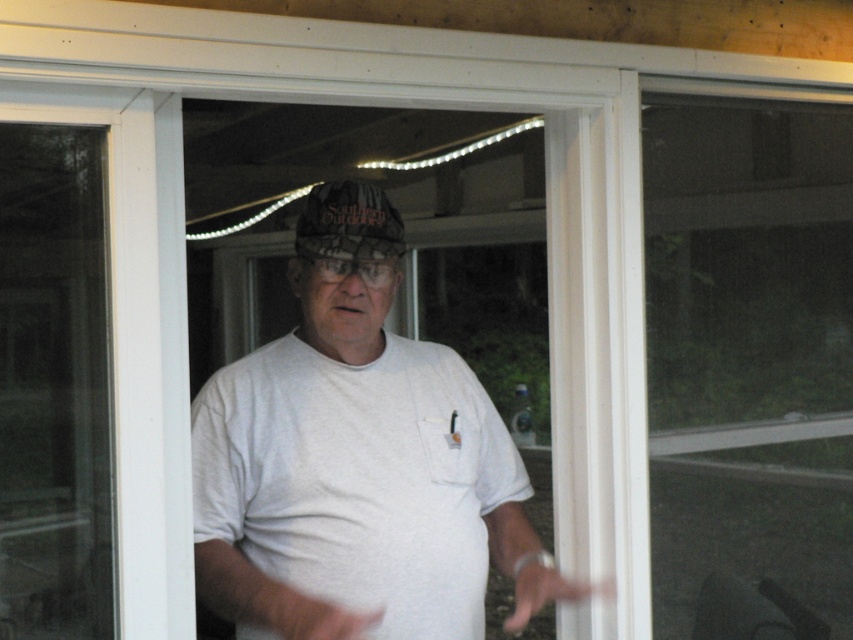
Is point (747, 211) farther from camera compared to point (326, 560)?

Yes, point (747, 211) is behind point (326, 560).

Can you confirm if transparent plastic screen door at right is thinner than white cotton t-shirt at center?

Correct, transparent plastic screen door at right's width is less than white cotton t-shirt at center's.

Is point (721, 212) in front of point (428, 408)?

No, it is not.

At what (x,y) coordinates should I click in order to perform the action: click on transparent plastic screen door at right. Please return your answer as a coordinate pair (x, y). The height and width of the screenshot is (640, 853). Looking at the image, I should click on (747, 365).

Is transparent plastic screen door at left smaller than camouflage fabric hat at center?

Actually, transparent plastic screen door at left might be larger than camouflage fabric hat at center.

Is transparent plastic screen door at left to the right of camouflage fabric hat at center from the viewer's perspective?

Incorrect, transparent plastic screen door at left is not on the right side of camouflage fabric hat at center.

Which is behind, point (7, 388) or point (345, 225)?

Positioned behind is point (345, 225).

What are the coordinates of `transparent plastic screen door at left` in the screenshot? It's located at (54, 385).

Is point (728, 518) less distant than point (30, 144)?

No.

This screenshot has width=853, height=640. What are the coordinates of `transparent plastic screen door at right` in the screenshot? It's located at [747, 365].